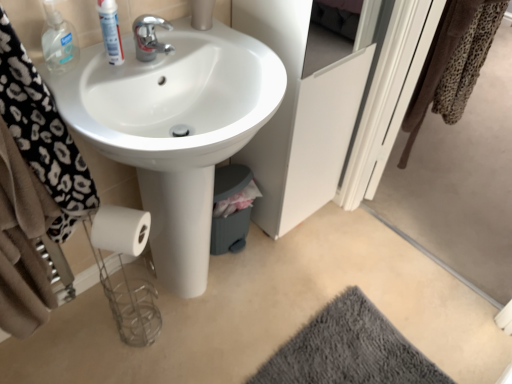
Identify the location of free space above gray fuzzy rug at lower right (from a real-world perspective). (355, 353).